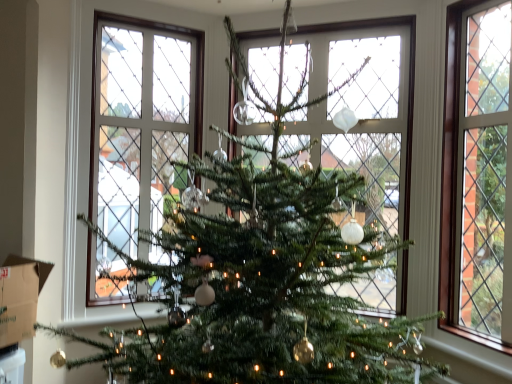
Question: From the image's perspective, is brown cardboard box at lower left positioned above or below clear glass window at right?

Choices:
 (A) below
 (B) above

Answer: (A)

Question: Considering the positions of brown cardboard box at lower left and clear glass window at right in the image, is brown cardboard box at lower left bigger or smaller than clear glass window at right?

Choices:
 (A) small
 (B) big

Answer: (A)

Question: Based on their positions, is brown cardboard box at lower left located to the left or right of clear glass window at right?

Choices:
 (A) left
 (B) right

Answer: (A)

Question: Based on their sizes in the image, would you say clear glass window at right is bigger or smaller than brown cardboard box at lower left?

Choices:
 (A) small
 (B) big

Answer: (B)

Question: From a real-world perspective, relative to brown cardboard box at lower left, is clear glass window at right vertically above or below?

Choices:
 (A) below
 (B) above

Answer: (B)

Question: From the image's perspective, is clear glass window at right above or below brown cardboard box at lower left?

Choices:
 (A) above
 (B) below

Answer: (A)

Question: Is clear glass window at right to the left or to the right of brown cardboard box at lower left in the image?

Choices:
 (A) left
 (B) right

Answer: (B)